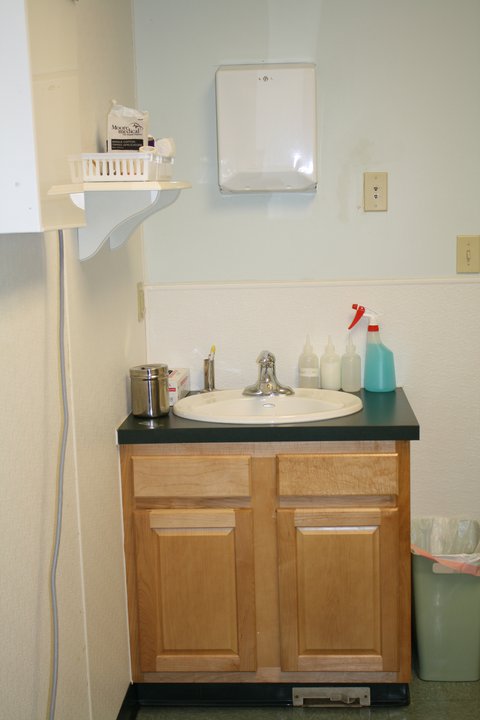
Locate an element on the screen. The width and height of the screenshot is (480, 720). vent is located at coordinates (353, 693).